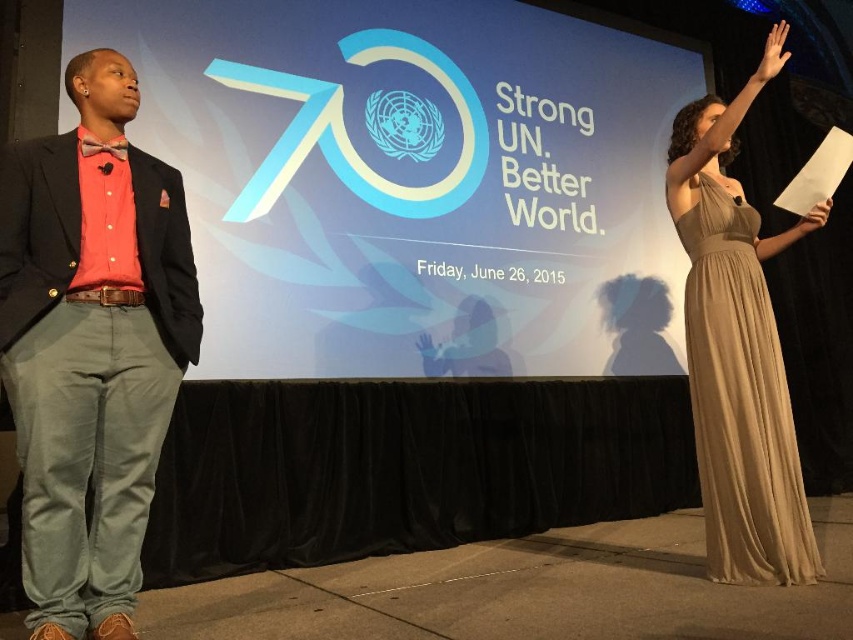
Can you confirm if brushed cotton suit at left is bigger than matte skin hand at upper right?

Indeed, brushed cotton suit at left has a larger size compared to matte skin hand at upper right.

The width and height of the screenshot is (853, 640). Describe the element at coordinates (91, 346) in the screenshot. I see `brushed cotton suit at left` at that location.

This screenshot has height=640, width=853. In order to click on brushed cotton suit at left in this screenshot , I will do `click(91, 346)`.

The width and height of the screenshot is (853, 640). Find the location of `satin beige dress at right`. satin beige dress at right is located at coordinates (740, 401).

Looking at this image, is satin beige dress at right to the left of white paper at upper right from the viewer's perspective?

Correct, you'll find satin beige dress at right to the left of white paper at upper right.

Where is `satin beige dress at right`? The image size is (853, 640). satin beige dress at right is located at coordinates (740, 401).

Can you confirm if brushed cotton suit at left is smaller than satin beige dress at right?

No.

What do you see at coordinates (91, 346) in the screenshot? I see `brushed cotton suit at left` at bounding box center [91, 346].

Identify the location of brushed cotton suit at left. 91,346.